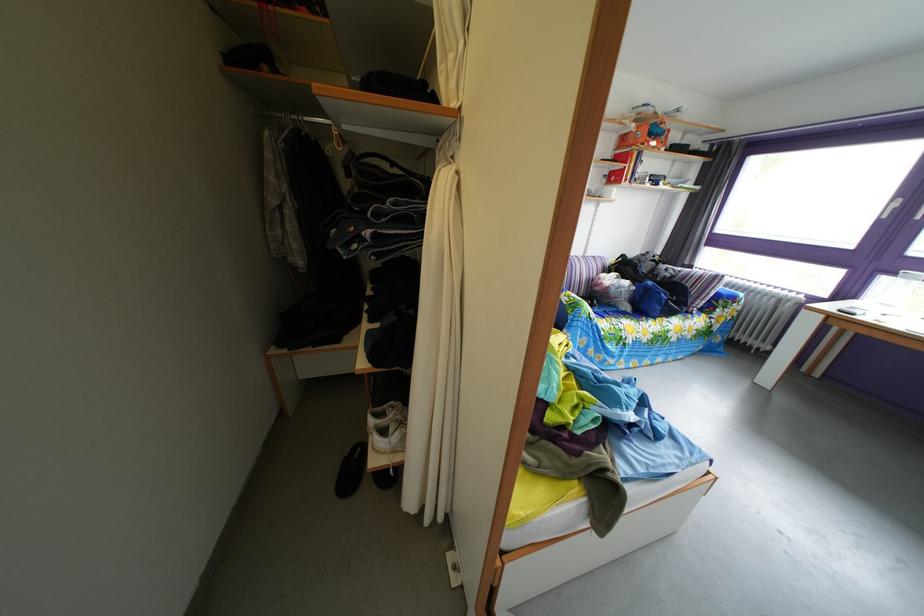
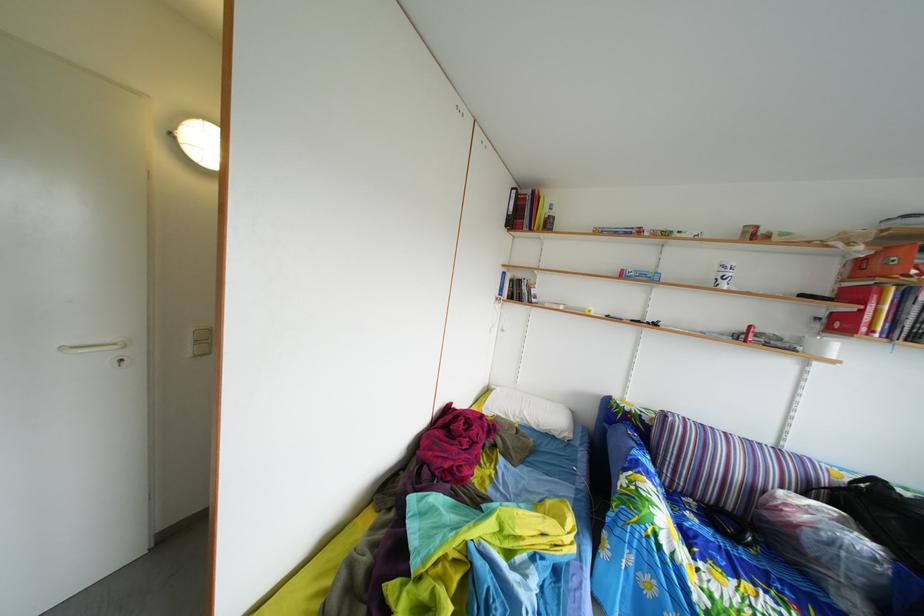
Question: I am providing you with two images of the same scene from different viewpoints. Which of the following objects are not visible in image2?

Choices:
 (A) light switch
 (B) blue backrest pillow
 (C) orange box
 (D) grey window curtain

Answer: (D)